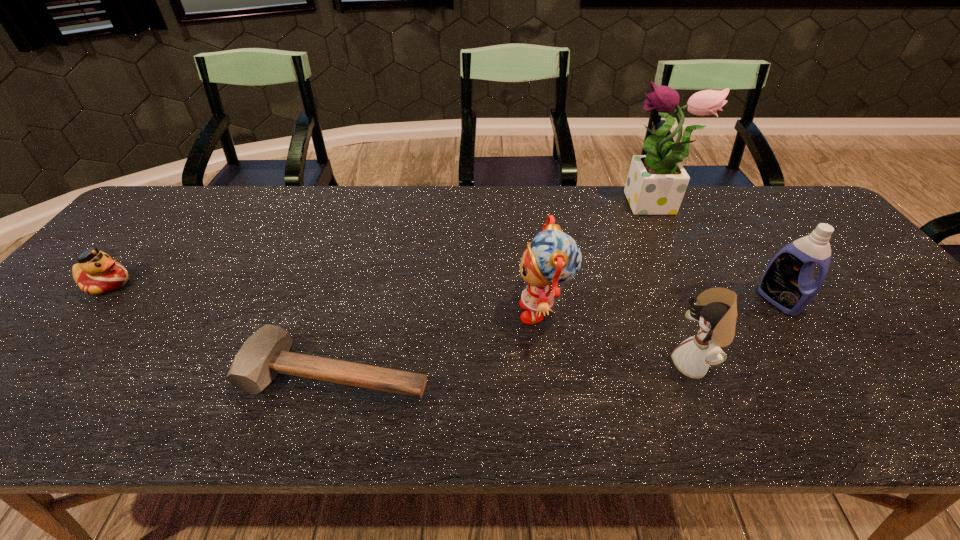
Locate an element on the screen. the farthest object is located at coordinates (656, 183).

Where is `flower arrangement`? The height and width of the screenshot is (540, 960). flower arrangement is located at coordinates (656, 183).

Where is `the third object from left to right`? the third object from left to right is located at coordinates (553, 257).

Locate an element on the screen. The image size is (960, 540). the rightmost object is located at coordinates (788, 283).

Identify the location of the right doll. The image size is (960, 540). (715, 309).

At what (x,y) coordinates should I click in order to perform the action: click on the leftmost object. Please return your answer as a coordinate pair (x, y). This screenshot has height=540, width=960. Looking at the image, I should click on (96, 273).

This screenshot has width=960, height=540. Identify the location of duck. (96, 273).

Locate an element on the screen. Image resolution: width=960 pixels, height=540 pixels. mallet is located at coordinates (266, 353).

At what (x,y) coordinates should I click in order to perform the action: click on the shortest object. Please return your answer as a coordinate pair (x, y). Looking at the image, I should click on (266, 353).

Locate an element on the screen. Image resolution: width=960 pixels, height=540 pixels. vacant region located 0.300m on the front-facing side of the flower arrangement is located at coordinates (524, 206).